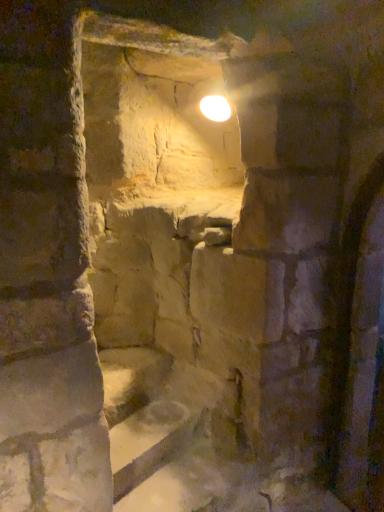
Question: From the image's perspective, is smooth stone stairs at lower center above white glossy light bulb at upper center?

Choices:
 (A) no
 (B) yes

Answer: (A)

Question: From a real-world perspective, is smooth stone stairs at lower center located beneath white glossy light bulb at upper center?

Choices:
 (A) yes
 (B) no

Answer: (A)

Question: Can you confirm if smooth stone stairs at lower center is thinner than white glossy light bulb at upper center?

Choices:
 (A) yes
 (B) no

Answer: (B)

Question: Can you confirm if smooth stone stairs at lower center is positioned to the right of white glossy light bulb at upper center?

Choices:
 (A) no
 (B) yes

Answer: (A)

Question: Considering the relative sizes of smooth stone stairs at lower center and white glossy light bulb at upper center in the image provided, is smooth stone stairs at lower center smaller than white glossy light bulb at upper center?

Choices:
 (A) no
 (B) yes

Answer: (A)

Question: Is smooth stone stairs at lower center further to camera compared to white glossy light bulb at upper center?

Choices:
 (A) yes
 (B) no

Answer: (B)

Question: Is white glossy light bulb at upper center thinner than smooth stone stairs at lower center?

Choices:
 (A) yes
 (B) no

Answer: (A)

Question: From a real-world perspective, is white glossy light bulb at upper center physically above smooth stone stairs at lower center?

Choices:
 (A) yes
 (B) no

Answer: (A)

Question: Is white glossy light bulb at upper center outside of smooth stone stairs at lower center?

Choices:
 (A) no
 (B) yes

Answer: (B)

Question: Is the depth of white glossy light bulb at upper center less than that of smooth stone stairs at lower center?

Choices:
 (A) yes
 (B) no

Answer: (B)

Question: Does white glossy light bulb at upper center have a larger size compared to smooth stone stairs at lower center?

Choices:
 (A) yes
 (B) no

Answer: (B)

Question: Is white glossy light bulb at upper center oriented away from smooth stone stairs at lower center?

Choices:
 (A) no
 (B) yes

Answer: (A)

Question: Visually, is white glossy light bulb at upper center positioned to the left or to the right of smooth stone stairs at lower center?

Choices:
 (A) left
 (B) right

Answer: (B)